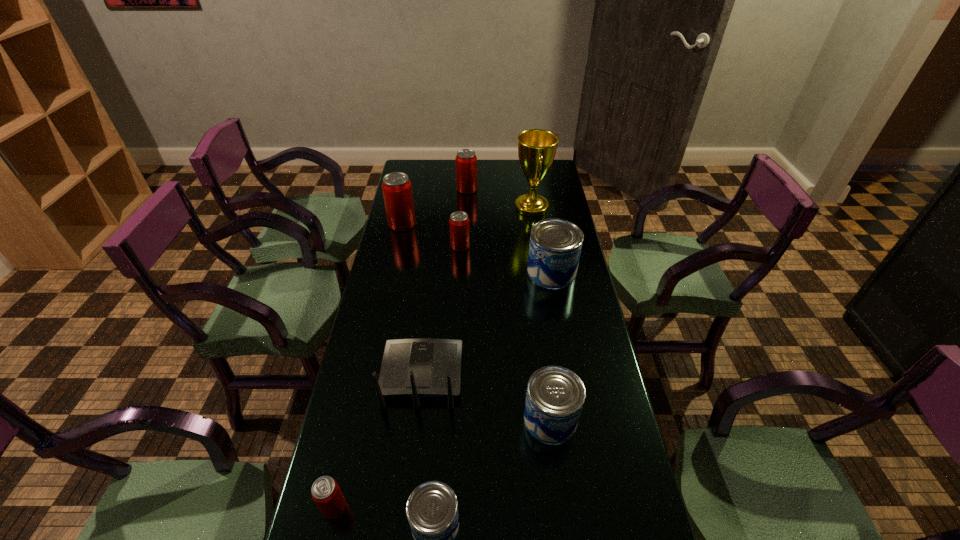
Where is `the sixth nearest object`? The image size is (960, 540). the sixth nearest object is located at coordinates (459, 226).

Find the location of a particular element. the second nearest blue can is located at coordinates (555, 395).

The width and height of the screenshot is (960, 540). I want to click on the third nearest can, so click(555, 395).

In order to click on the nearest red can in this screenshot , I will do `click(326, 493)`.

Identify the location of vacant space located by the handles of the gold award. The image size is (960, 540). pos(460,207).

Locate an element on the screen. Image resolution: width=960 pixels, height=540 pixels. vacant area situated 0.390m by the handles of the gold award is located at coordinates (423, 207).

At what (x,y) coordinates should I click in order to perform the action: click on blank space located by the handles of the gold award. Please return your answer as a coordinate pair (x, y). Looking at the image, I should click on click(433, 207).

What are the coordinates of `vacant space located 0.300m on the back of the tallest can` in the screenshot? It's located at (412, 179).

The width and height of the screenshot is (960, 540). I want to click on vacant space situated on the right of the farthest red can, so click(x=492, y=189).

Locate an element on the screen. The height and width of the screenshot is (540, 960). vacant space situated on the front label of the biggest blue can is located at coordinates (563, 336).